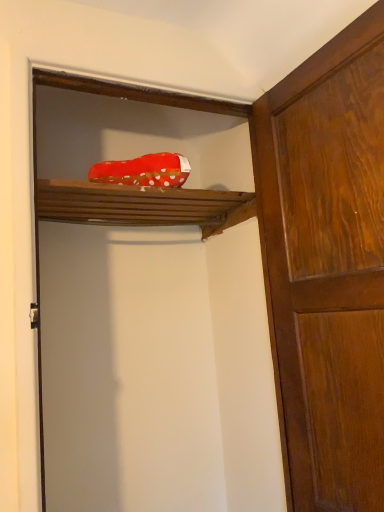
Question: Is wooden door at right, the 2th door viewed from the left, taller or shorter than red polka dot fabric at upper center?

Choices:
 (A) short
 (B) tall

Answer: (B)

Question: From a real-world perspective, is wooden door at right, the 2th door viewed from the left, physically located above or below red polka dot fabric at upper center?

Choices:
 (A) below
 (B) above

Answer: (A)

Question: Estimate the real-world distances between objects in this image. Which object is closer to the red polka dot fabric at upper center?

Choices:
 (A) wooden door at right, positioned as the 1th door in right-to-left order
 (B) red polka dot fabric at center
 (C) wooden door at upper center, which appears as the 1th door when viewed from the left

Answer: (B)

Question: Based on their relative distances, which object is farther from the red polka dot fabric at upper center?

Choices:
 (A) wooden door at upper center, the 2th door from the right
 (B) wooden door at right, positioned as the 1th door in right-to-left order
 (C) red polka dot fabric at center

Answer: (B)